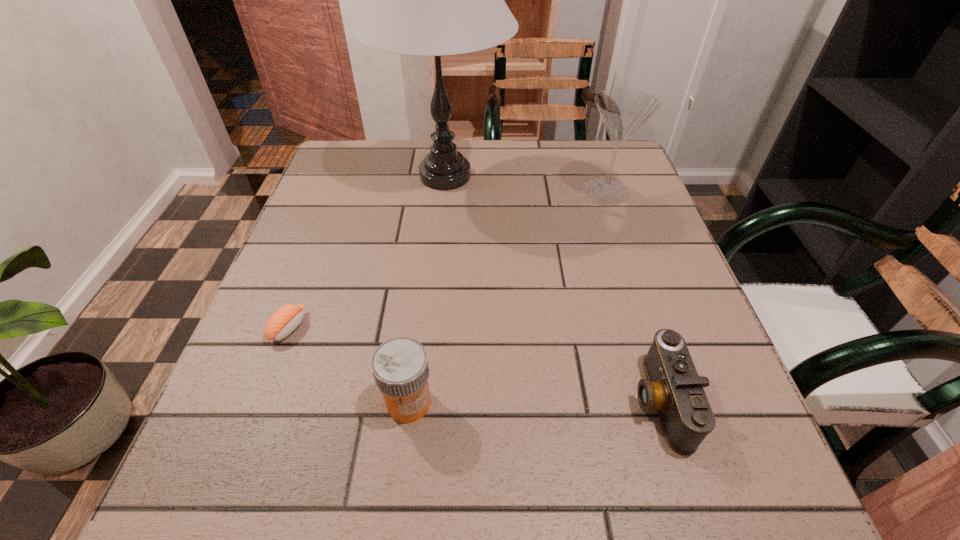
This screenshot has width=960, height=540. What are the coordinates of `object that is positioned at the far left corner` in the screenshot? It's located at (435, 0).

Identify the location of object present at the far right corner. pyautogui.click(x=623, y=111).

The height and width of the screenshot is (540, 960). I want to click on object that is at the near right corner, so coord(673,387).

Where is `vacant region at the far edge of the desktop`? The height and width of the screenshot is (540, 960). vacant region at the far edge of the desktop is located at coordinates coord(389,168).

I want to click on free space at the left edge, so click(x=329, y=288).

The width and height of the screenshot is (960, 540). In the image, there is a desktop. Identify the location of vacant space at the right edge. (667, 444).

Image resolution: width=960 pixels, height=540 pixels. In order to click on vacant space at the far left corner of the desktop in this screenshot , I will do `click(361, 140)`.

Where is `vacant space at the near left corner of the desktop`? This screenshot has height=540, width=960. vacant space at the near left corner of the desktop is located at coordinates (249, 501).

Where is `vacant space at the far right corner of the desktop`? The height and width of the screenshot is (540, 960). vacant space at the far right corner of the desktop is located at coordinates (626, 180).

Where is `free space at the near right corner of the desktop`? free space at the near right corner of the desktop is located at coordinates (732, 473).